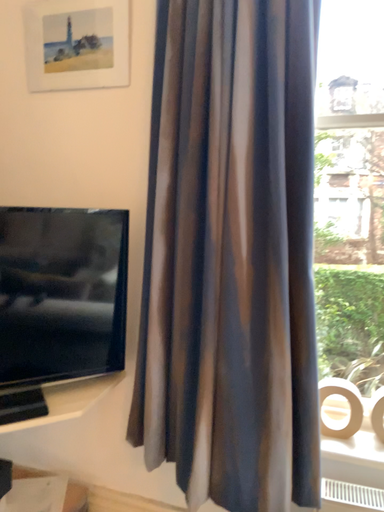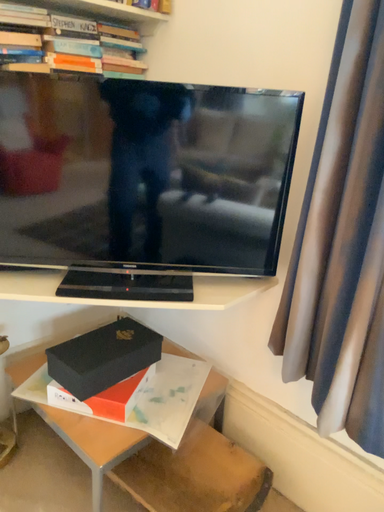
Question: Which way did the camera rotate in the video?

Choices:
 (A) rotated left
 (B) rotated right

Answer: (A)